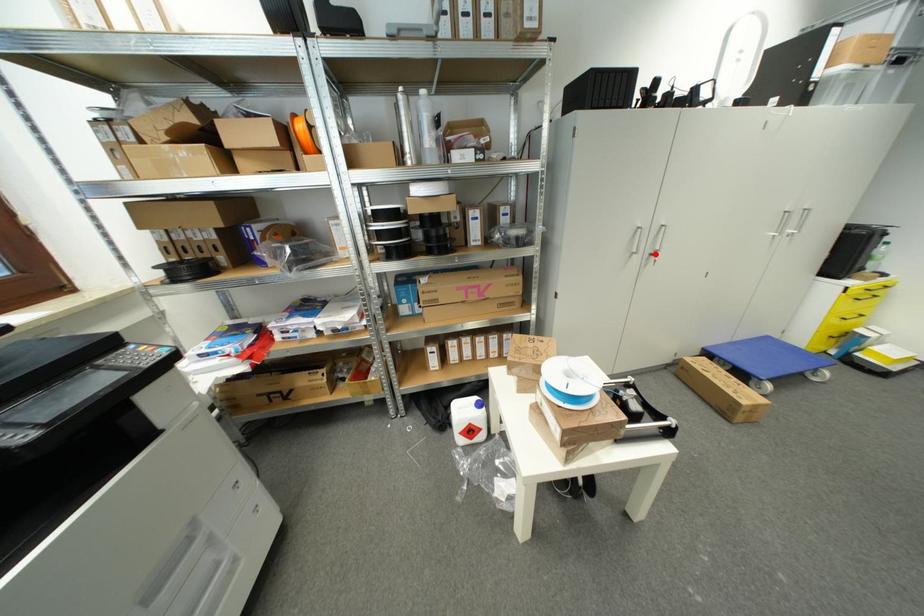
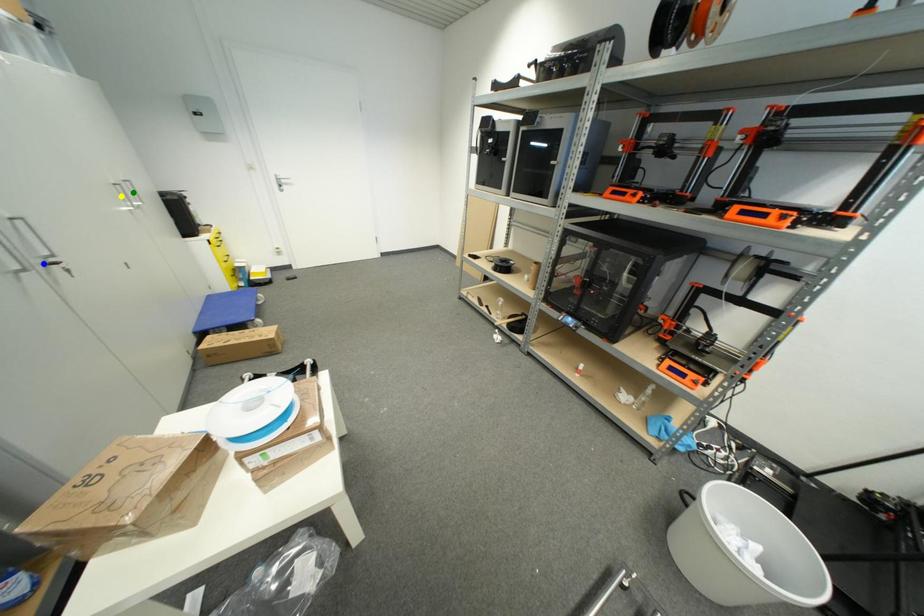
Question: I am providing you with two images of the same scene from different viewpoints. A red point is marked on the first image. You are given multiple points on the second image. Which mark in image 2 goes with the point in image 1?

Choices:
 (A) yellow point
 (B) blue point
 (C) green point

Answer: (B)